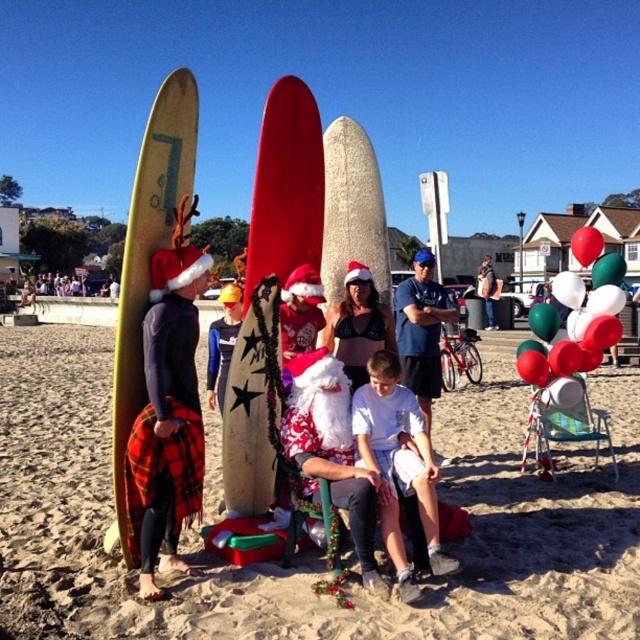
Can you confirm if plaid fabric surfboard at left is positioned to the right of yellow matte surfboard at left?

Correct, you'll find plaid fabric surfboard at left to the right of yellow matte surfboard at left.

Where is `plaid fabric surfboard at left`? The image size is (640, 640). plaid fabric surfboard at left is located at coordinates (166, 419).

How distant is smooth beige surfboard at center from santa hat bikini top at center?

smooth beige surfboard at center is 3.41 inches from santa hat bikini top at center.

Who is taller, smooth beige surfboard at center or santa hat bikini top at center?

smooth beige surfboard at center is taller.

Is point (384, 269) farther from camera compared to point (337, 317)?

Yes, point (384, 269) is behind point (337, 317).

In order to click on smooth beige surfboard at center in this screenshot , I will do `click(355, 250)`.

The image size is (640, 640). What do you see at coordinates (397, 460) in the screenshot?
I see `white cotton shirt at center` at bounding box center [397, 460].

Between point (372, 419) and point (220, 346), which one is positioned in front?

Point (372, 419) is in front.

Which is in front, point (410, 412) or point (234, 340)?

Point (410, 412)

Where is `white cotton shirt at center`? The image size is (640, 640). white cotton shirt at center is located at coordinates (397, 460).